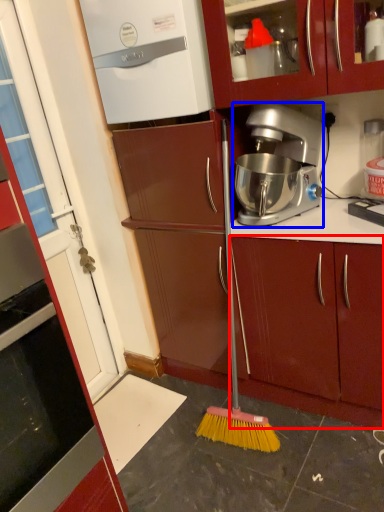
Question: Among these objects, which one is nearest to the camera, cabinetry (highlighted by a red box) or coffee maker (highlighted by a blue box)?

Choices:
 (A) cabinetry
 (B) coffee maker

Answer: (B)